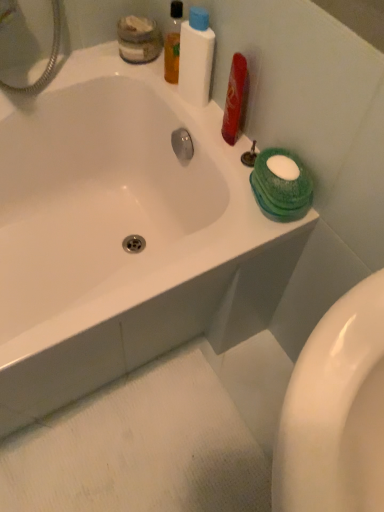
Question: Considering the relative positions of translucent plastic mouthwash at upper center and white glossy bathtub at upper center in the image provided, is translucent plastic mouthwash at upper center behind white glossy bathtub at upper center?

Choices:
 (A) no
 (B) yes

Answer: (B)

Question: Is translucent plastic mouthwash at upper center placed right next to white glossy bathtub at upper center?

Choices:
 (A) yes
 (B) no

Answer: (B)

Question: Can you confirm if translucent plastic mouthwash at upper center is positioned to the left of white glossy bathtub at upper center?

Choices:
 (A) no
 (B) yes

Answer: (A)

Question: Does translucent plastic mouthwash at upper center have a greater height compared to white glossy bathtub at upper center?

Choices:
 (A) no
 (B) yes

Answer: (A)

Question: Considering the relative sizes of translucent plastic mouthwash at upper center and white glossy bathtub at upper center in the image provided, is translucent plastic mouthwash at upper center shorter than white glossy bathtub at upper center?

Choices:
 (A) no
 (B) yes

Answer: (B)

Question: Is translucent plastic mouthwash at upper center closer to the viewer compared to white glossy bathtub at upper center?

Choices:
 (A) yes
 (B) no

Answer: (B)

Question: From a real-world perspective, is white glossy bathtub at upper center over translucent plastic mouthwash at upper center?

Choices:
 (A) no
 (B) yes

Answer: (A)

Question: Is white glossy bathtub at upper center bigger than translucent plastic mouthwash at upper center?

Choices:
 (A) no
 (B) yes

Answer: (B)

Question: From a real-world perspective, is white glossy bathtub at upper center positioned under translucent plastic mouthwash at upper center based on gravity?

Choices:
 (A) yes
 (B) no

Answer: (A)

Question: Is translucent plastic mouthwash at upper center surrounded by white glossy bathtub at upper center?

Choices:
 (A) yes
 (B) no

Answer: (B)

Question: Considering the relative positions of white glossy bathtub at upper center and translucent plastic mouthwash at upper center in the image provided, is white glossy bathtub at upper center behind translucent plastic mouthwash at upper center?

Choices:
 (A) no
 (B) yes

Answer: (A)

Question: Is white glossy bathtub at upper center positioned with its back to translucent plastic mouthwash at upper center?

Choices:
 (A) no
 (B) yes

Answer: (A)

Question: Is the position of translucent plastic mouthwash at upper center less distant than that of matte glass jar at upper left?

Choices:
 (A) yes
 (B) no

Answer: (A)